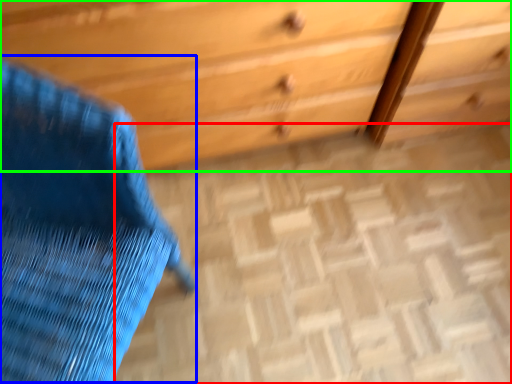
Question: Which object is the farthest from plain (highlighted by a red box)? Choose among these: swivel chair (highlighted by a blue box) or chest of drawers (highlighted by a green box).

Choices:
 (A) swivel chair
 (B) chest of drawers

Answer: (A)